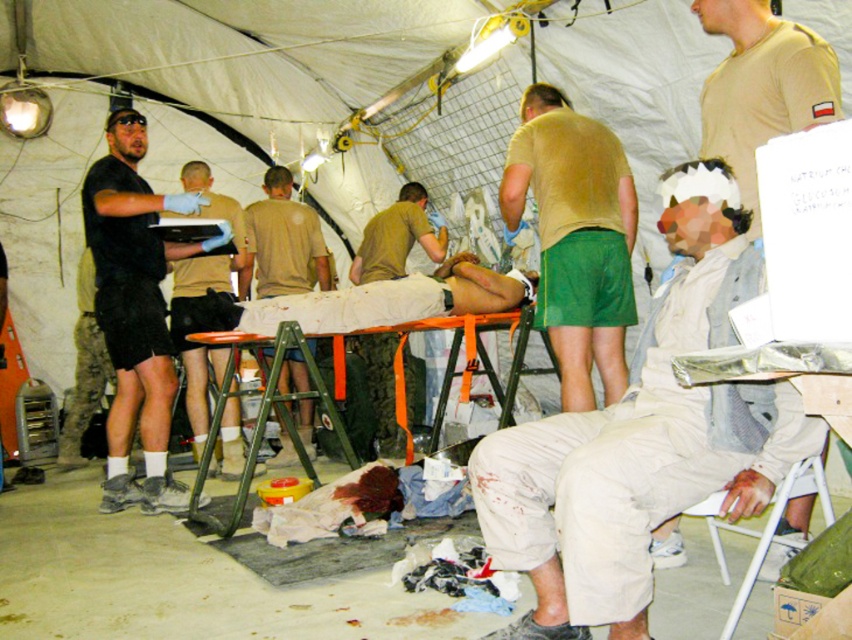
You are a medical responder assessing the scene. You see a white cotton shirt at center and a light brown uniform at center. Which clothing item is positioned higher in the image?

The white cotton shirt at center is much taller than the light brown uniform at center, so the white cotton shirt at center is positioned higher in the image.